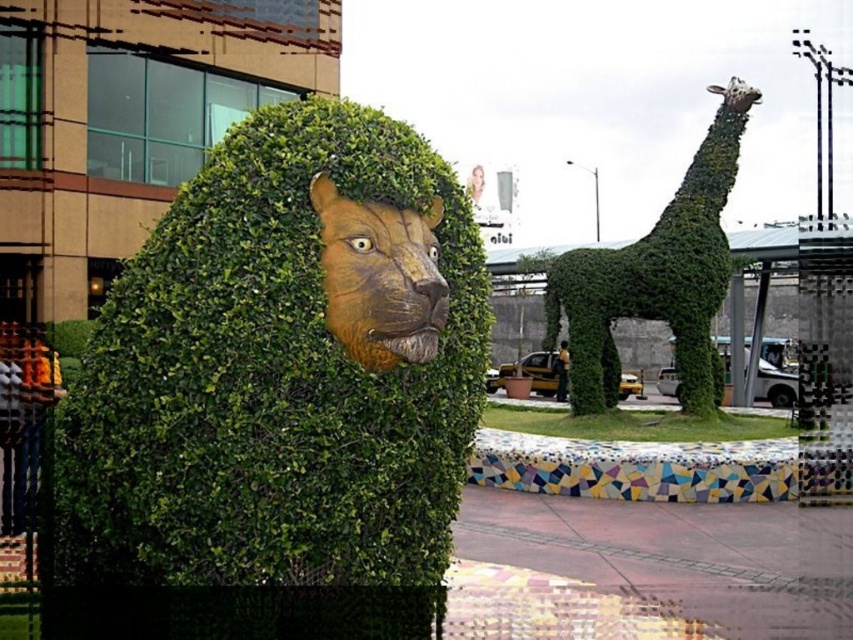
You are standing in front of the lion sculpture and want to take a photo of the giraffe sculpture. The camera you have can focus on objects up to 15 meters away. Will the green leafy giraffe at right be in focus?

The distance between the green leafy giraffe at right and the camera is 12.44 meters, which is within the camera focus range of 15 meters. Therefore, the green leafy giraffe at right will be in focus.

You are an artist planning to place a new sculpture between the green leafy hedge at center and the brown textured lion head at center. Based on their widths, which object should you position closer to the edge to ensure the sculpture fits comfortably?

The green leafy hedge at center is wider than the brown textured lion head at center. Therefore, you should position the green leafy hedge at center closer to the edge to accommodate the sculpture comfortably between them.